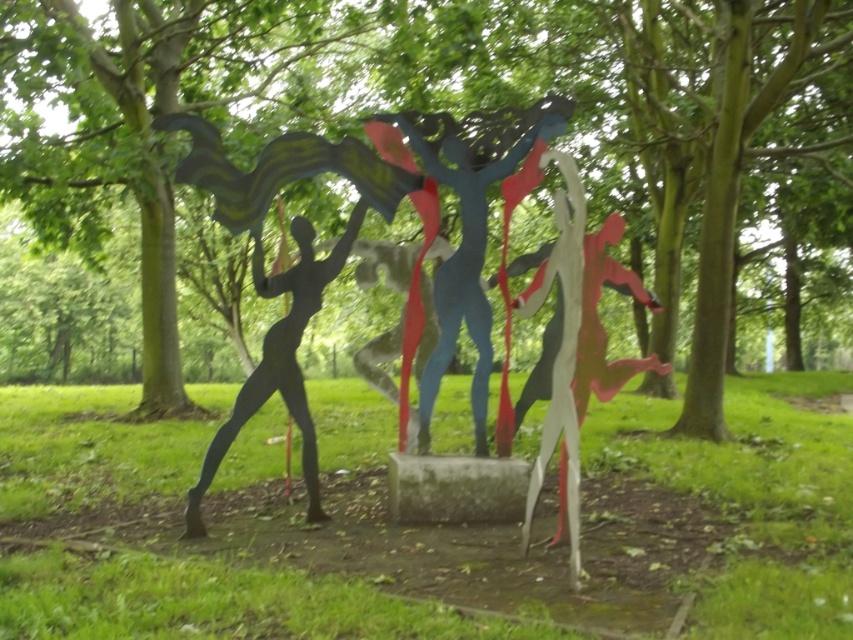
Who is lower down, metallic sculpture at center or metallic blue figure at center?

metallic sculpture at center is below.

Between point (628, 572) and point (445, 346), which one is positioned behind?

The point (445, 346) is more distant.

Locate an element on the screen. metallic sculpture at center is located at coordinates (426, 525).

Who is higher up, green leafy tree at center or metallic blue figure at center?

green leafy tree at center is higher up.

Between point (491, 236) and point (460, 196), which one is positioned behind?

Positioned behind is point (491, 236).

Identify the location of green leafy tree at center. (599, 108).

Does point (547, 432) come farther from viewer compared to point (321, 260)?

That is False.

Locate an element on the screen. metallic silver figure at center is located at coordinates (576, 340).